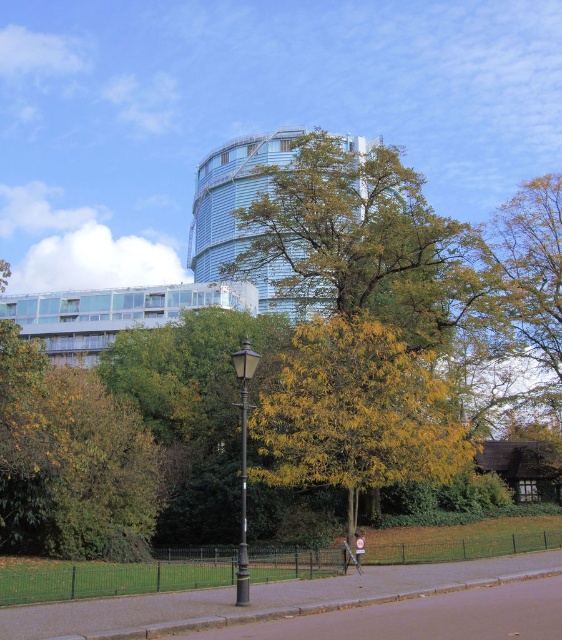
Can you confirm if paved concrete sidewalk at center is positioned to the left of metallic signpost at center?

Indeed, paved concrete sidewalk at center is positioned on the left side of metallic signpost at center.

Can you confirm if paved concrete sidewalk at center is wider than metallic signpost at center?

Yes, paved concrete sidewalk at center is wider than metallic signpost at center.

I want to click on paved concrete sidewalk at center, so click(x=262, y=598).

Does yellow-green leaves at center appear over paved concrete sidewalk at center?

Indeed, yellow-green leaves at center is positioned over paved concrete sidewalk at center.

Describe the element at coordinates (355, 412) in the screenshot. This screenshot has height=640, width=562. I see `yellow-green leaves at center` at that location.

Find the location of `yellow-green leaves at center`. yellow-green leaves at center is located at coordinates (355, 412).

Is polished brass lamp post at center below metallic signpost at center?

Incorrect, polished brass lamp post at center is not positioned below metallic signpost at center.

Does point (257, 355) come closer to viewer compared to point (355, 541)?

Yes, point (257, 355) is closer to viewer.

Is point (242, 412) positioned behind point (359, 548)?

No, (242, 412) is in front of (359, 548).

Identify the location of polished brass lamp post at center. (243, 461).